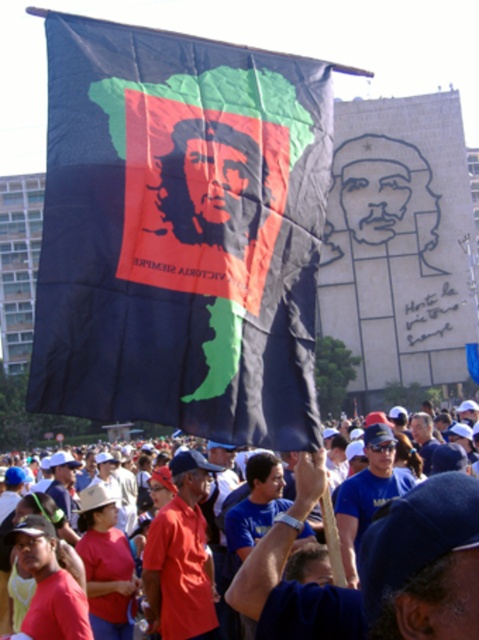
You are a photographer at the protest. You want to capture a photo that includes both the matte black flag at upper center and the blue fabric at center. Which object should you position closer to the top of the frame?

The matte black flag at upper center should be positioned closer to the top of the frame since it is above the blue fabric at center.

You are a photographer trying to capture the black fabric flag at center in your shot. Given that your camera has a focal point at coordinates 0.5, 0.5, will the flag be centered in your photo?

The black fabric flag at center is positioned at coordinates (181,232), which is slightly to the left and below the camera focal point at (239,320). Therefore, the flag will not be perfectly centered in the photo.

From the picture: You are a photographer at the demonstration. You want to capture a photo of the black fabric flag at center. You notice a point at coordinates [181,232] in the image. Is this point located on the black fabric flag at center?

Yes, the point at coordinates [181,232] is located on the black fabric flag at center as stated in the description.